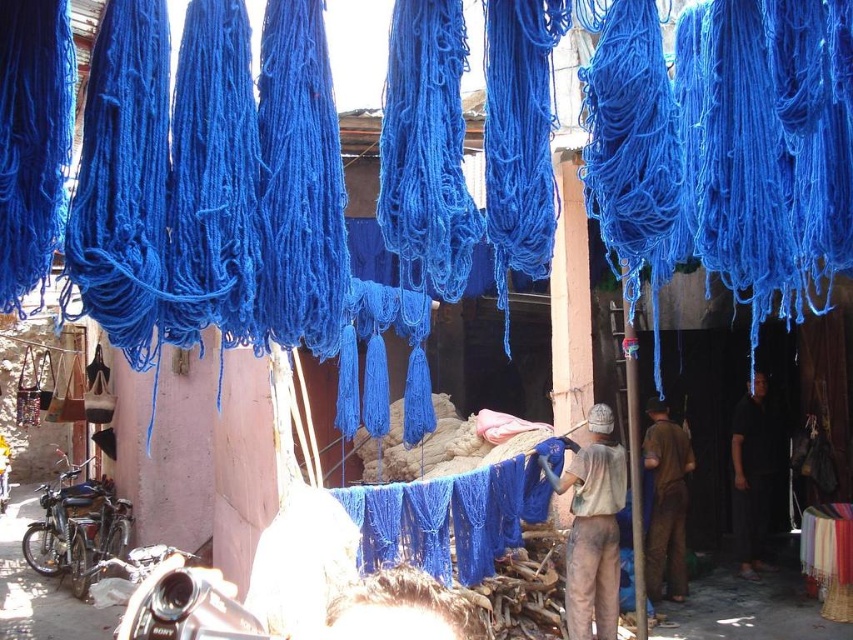
Between black cotton shirt at center and brown fabric at center, which one is positioned lower?

Positioned lower is brown fabric at center.

What do you see at coordinates (753, 476) in the screenshot? The width and height of the screenshot is (853, 640). I see `black cotton shirt at center` at bounding box center [753, 476].

Which is in front, point (734, 531) or point (683, 451)?

Point (683, 451) is more forward.

Locate an element on the screen. The image size is (853, 640). black cotton shirt at center is located at coordinates (753, 476).

Does dirty beige shirt at center have a lesser height compared to brown fabric at center?

Correct, dirty beige shirt at center is not as tall as brown fabric at center.

Identify the location of dirty beige shirt at center. (592, 525).

In order to click on dirty beige shirt at center in this screenshot , I will do `click(592, 525)`.

Can you confirm if dirty beige shirt at center is positioned above black cotton shirt at center?

Yes.

Between dirty beige shirt at center and black cotton shirt at center, which one is positioned lower?

black cotton shirt at center

Is point (578, 531) more distant than point (740, 426)?

No, (578, 531) is in front of (740, 426).

This screenshot has width=853, height=640. I want to click on dirty beige shirt at center, so click(592, 525).